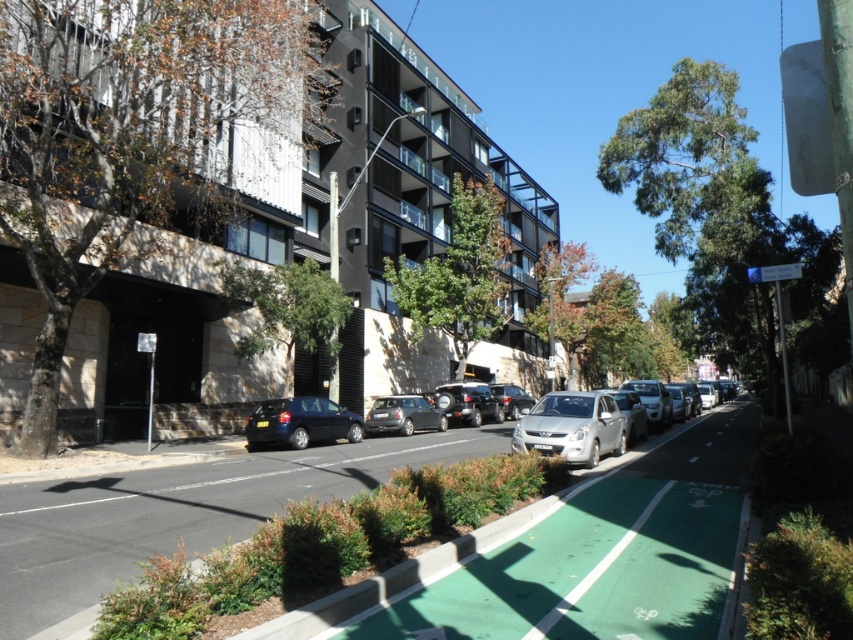
You are a delivery person who needs to park your silver metallic car at center in a spot that is exactly at coordinate point 0.669, 0.671. Can you confirm if the car is already parked correctly?

The silver metallic car at center is already positioned at point (x=572, y=428), so it is parked correctly.

You are a delivery person who needs to cross the street from the green rubber bike lane at center to the metallic silver sedan at center. The city requires that pedestrians must wait at least 15 meters away from vehicles. Can you safely cross without violating this rule?

The distance between the green rubber bike lane at center and the metallic silver sedan at center is 16.87 meters, which is more than the required 15 meters. Therefore, you can safely cross without violating the rule.